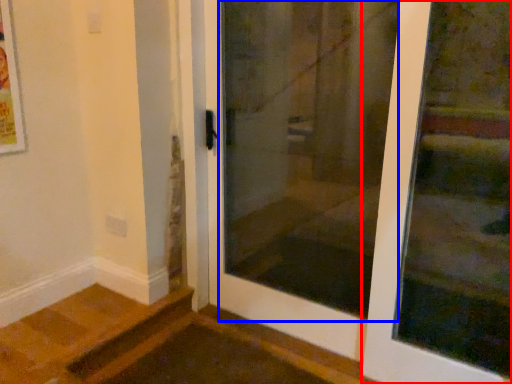
Question: Among these objects, which one is nearest to the camera, door (highlighted by a red box) or screen door (highlighted by a blue box)?

Choices:
 (A) door
 (B) screen door

Answer: (A)